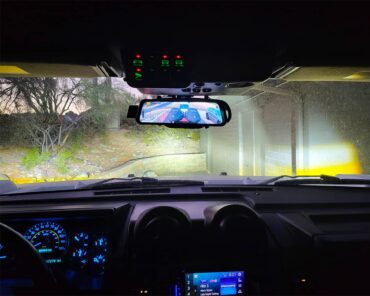
At what (x,y) coordinates should I click in order to perform the action: click on radio screen. Please return your answer as a coordinate pair (x, y). This screenshot has width=370, height=296. Looking at the image, I should click on (211, 288).